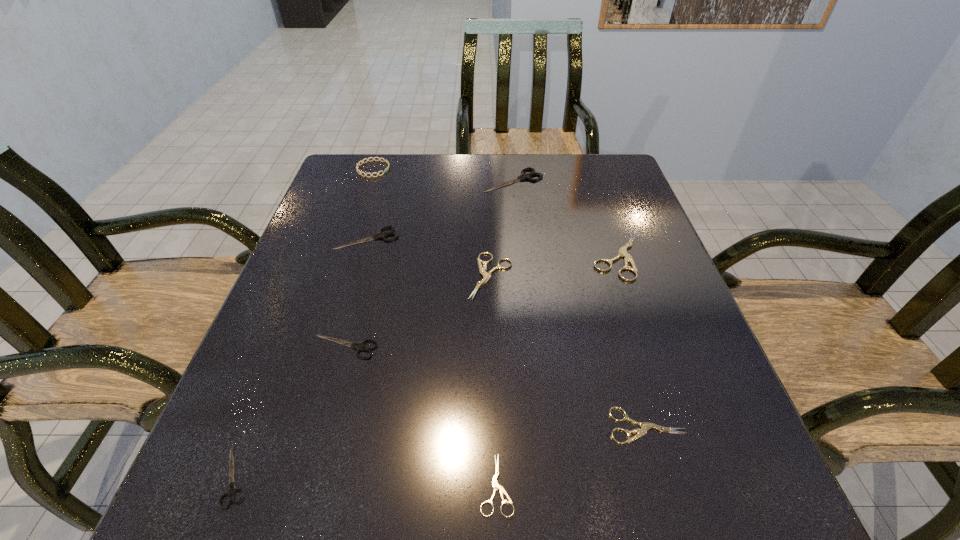
Identify the location of vacant space at the left edge of the desktop. [x=264, y=451].

In the image, there is a desktop. Identify the location of vacant area at the right edge. The height and width of the screenshot is (540, 960). (666, 372).

Locate an element on the screen. blank space at the far left corner is located at coordinates (382, 189).

Where is `free location at the far right corner of the desktop`? The image size is (960, 540). free location at the far right corner of the desktop is located at coordinates (602, 181).

Identify the location of vacant space that is in between the blue bracelet and the third biggest beige shears. The width and height of the screenshot is (960, 540). (510, 298).

Locate an element on the screen. The height and width of the screenshot is (540, 960). free area in between the second biggest black shears and the second nearest beige shears is located at coordinates point(507,332).

This screenshot has width=960, height=540. I want to click on empty space between the third smallest black shears and the nearest beige shears, so click(x=432, y=361).

The height and width of the screenshot is (540, 960). I want to click on vacant area between the third nearest black shears and the rightmost black shears, so click(x=441, y=210).

Where is `blank region between the second biggest black shears and the second smallest black shears`? The image size is (960, 540). blank region between the second biggest black shears and the second smallest black shears is located at coordinates (356, 293).

Locate an element on the screen. vacant space that is in between the blue bracelet and the sixth farthest object is located at coordinates (359, 258).